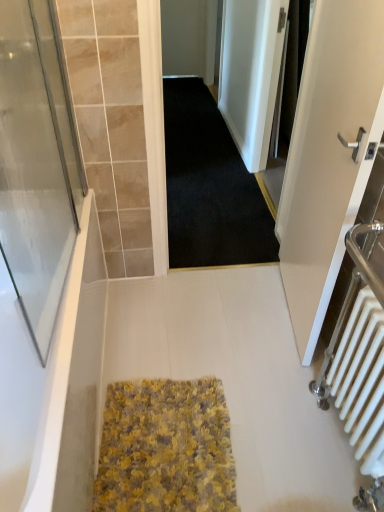
Locate an element on the screen. This screenshot has width=384, height=512. vacant area that lies to the right of yellow textured rug at center is located at coordinates (284, 429).